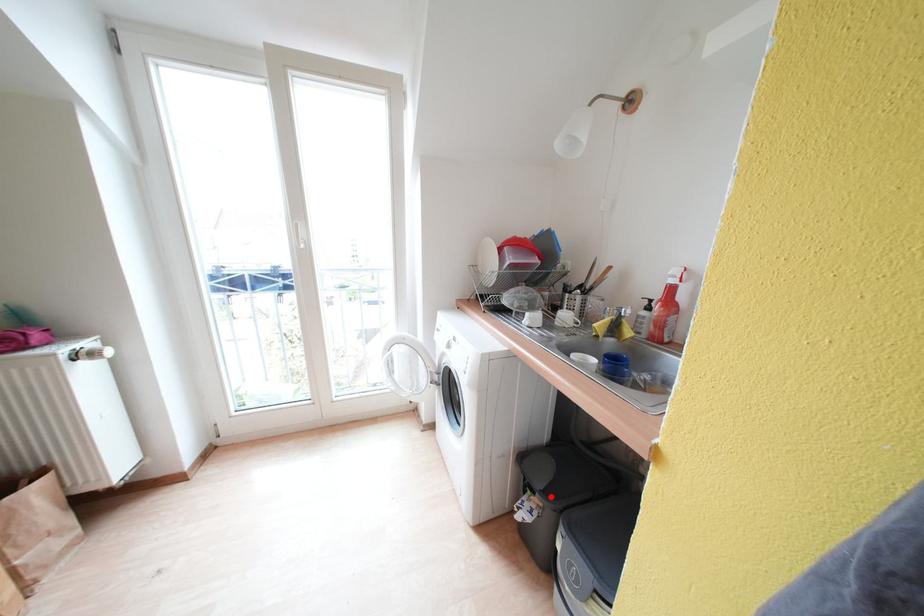
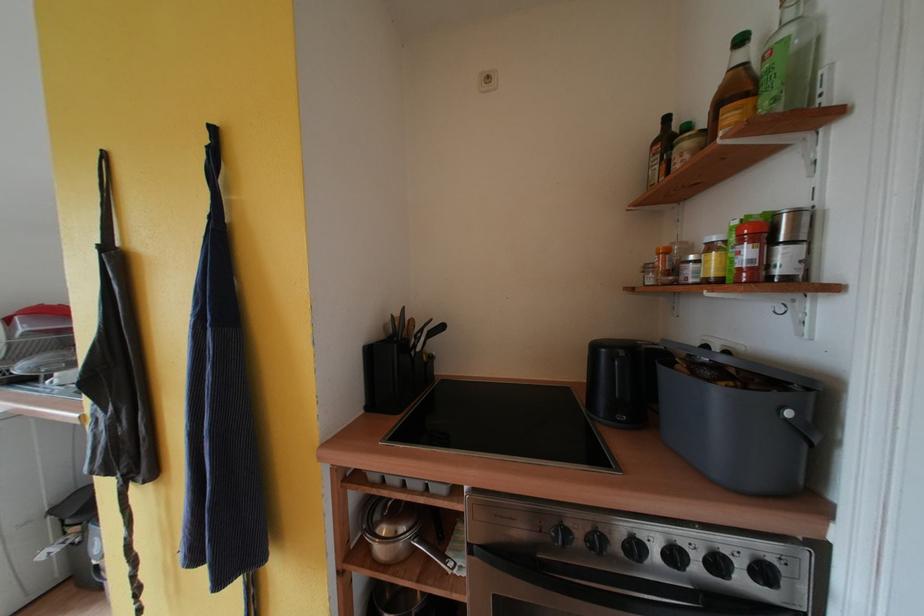
In the second image, find the point that corresponds to the highlighted location in the first image.

(83, 517)